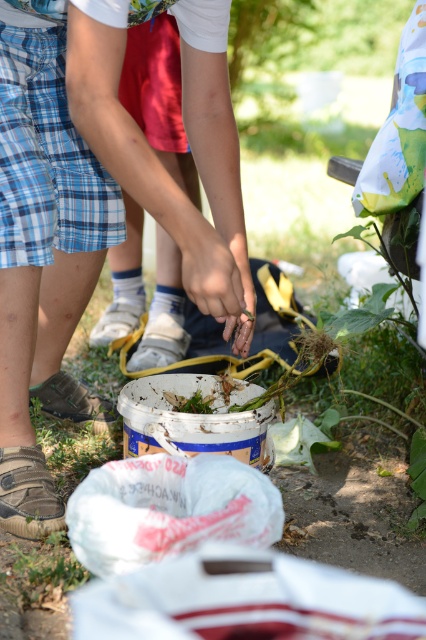
Who is lower down, blue plaid shorts at center or green leafy plant at lower left?

green leafy plant at lower left is lower down.

Does blue plaid shorts at center come behind green leafy plant at lower left?

No, blue plaid shorts at center is closer to the viewer.

Between point (232, 214) and point (69, 554), which one is positioned in front?

Point (232, 214)

You are a GUI agent. You are given a task and a screenshot of the screen. Output one action in this format:
    pyautogui.click(x=<x>, y=<y>)
    Task: Click on the blue plaid shorts at center
    The image size is (426, 640).
    Given the screenshot: What is the action you would take?
    pyautogui.click(x=166, y=170)

Who is more forward, (86, 182) or (74, 556)?

Positioned in front is point (74, 556).

Which is behind, point (8, 358) or point (19, 572)?

The point (8, 358) is behind.

You are a GUI agent. You are given a task and a screenshot of the screen. Output one action in this format:
    pyautogui.click(x=<x>, y=<y>)
    Task: Click on the blue plaid shorts at lower left
    
    Given the screenshot: What is the action you would take?
    pyautogui.click(x=43, y=253)

Is blue plaid shorts at lower left wider than blue plaid shorts at center?

No.

Who is more distant from viewer, (55, 404) or (109, 147)?

The point (55, 404) is behind.

This screenshot has height=640, width=426. I want to click on blue plaid shorts at lower left, so click(x=43, y=253).

Where is `blue plaid shorts at lower left`? This screenshot has height=640, width=426. blue plaid shorts at lower left is located at coordinates (43, 253).